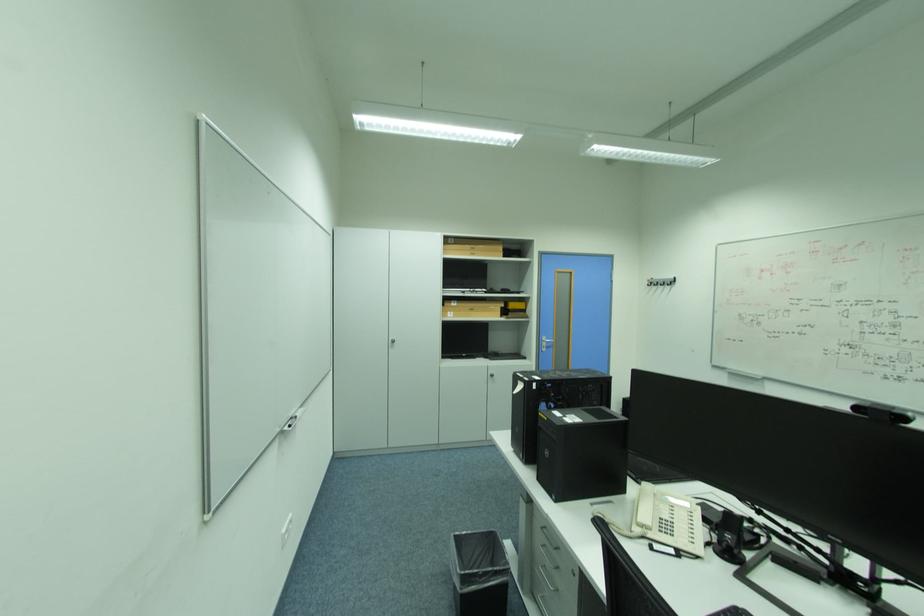
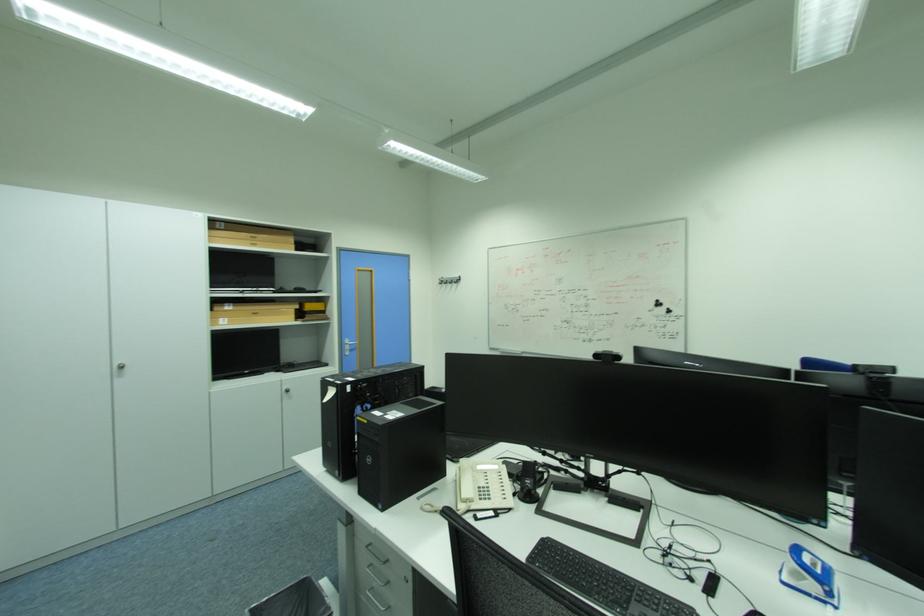
Find the pixel in the second image that matches point 659,283 in the first image.

(448, 282)